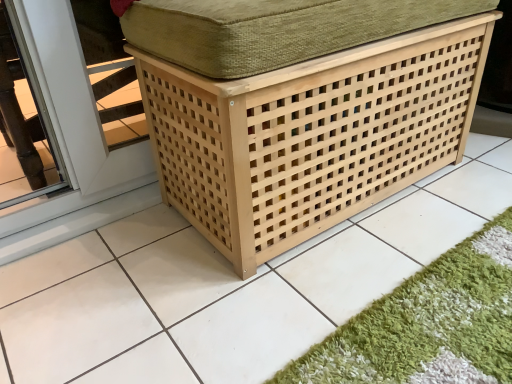
Question: Considering the positions of natural wood lattice storage box at center and green shaggy bath mat at lower right in the image, is natural wood lattice storage box at center wider or thinner than green shaggy bath mat at lower right?

Choices:
 (A) thin
 (B) wide

Answer: (B)

Question: From the image's perspective, relative to green shaggy bath mat at lower right, is natural wood lattice storage box at center above or below?

Choices:
 (A) above
 (B) below

Answer: (A)

Question: From a real-world perspective, relative to green shaggy bath mat at lower right, is natural wood lattice storage box at center vertically above or below?

Choices:
 (A) below
 (B) above

Answer: (B)

Question: Considering the positions of green shaggy bath mat at lower right and natural wood lattice storage box at center in the image, is green shaggy bath mat at lower right taller or shorter than natural wood lattice storage box at center?

Choices:
 (A) tall
 (B) short

Answer: (B)

Question: Would you say green shaggy bath mat at lower right is to the left or to the right of natural wood lattice storage box at center in the picture?

Choices:
 (A) left
 (B) right

Answer: (B)

Question: From a real-world perspective, relative to natural wood lattice storage box at center, is green shaggy bath mat at lower right vertically above or below?

Choices:
 (A) below
 (B) above

Answer: (A)

Question: Is green shaggy bath mat at lower right inside the boundaries of natural wood lattice storage box at center, or outside?

Choices:
 (A) outside
 (B) inside

Answer: (A)